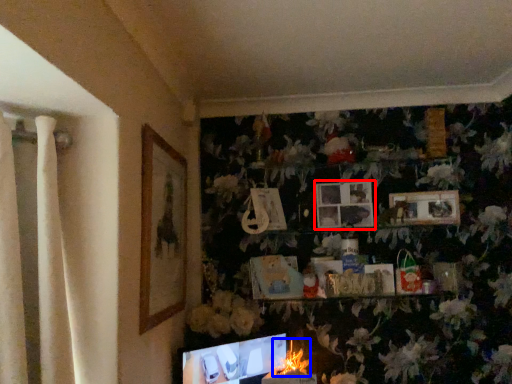
Question: Which of the following is the closest to the observer, picture frame (highlighted by a red box) or flower (highlighted by a blue box)?

Choices:
 (A) picture frame
 (B) flower

Answer: (B)